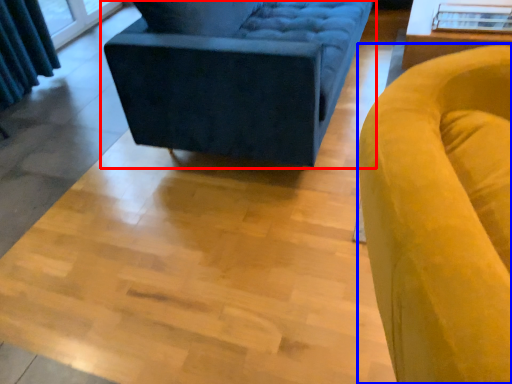
Question: Which of the following is the farthest to the observer, studio couch (highlighted by a red box) or chair (highlighted by a blue box)?

Choices:
 (A) studio couch
 (B) chair

Answer: (A)